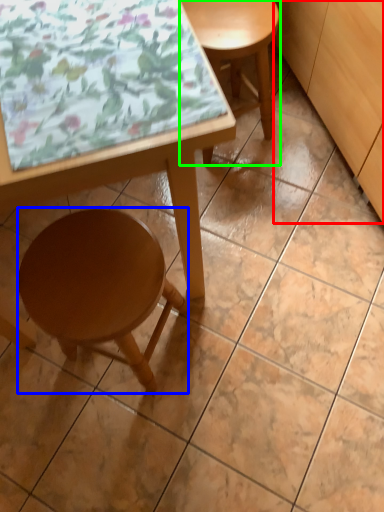
Question: Based on their relative distances, which object is nearer to cabinetry (highlighted by a red box)? Choose from stool (highlighted by a blue box) and stool (highlighted by a green box).

Choices:
 (A) stool
 (B) stool

Answer: (B)